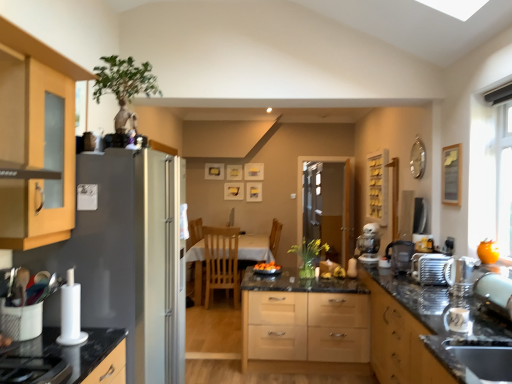
Question: Considering the relative positions of satin silver toaster at right and wooden cabinet at upper center, placed as the 1th cabinetry when sorted from back to front, in the image provided, is satin silver toaster at right to the left or to the right of wooden cabinet at upper center, placed as the 1th cabinetry when sorted from back to front,?

Choices:
 (A) left
 (B) right

Answer: (A)

Question: Considering the positions of satin silver toaster at right and wooden cabinet at upper center, placed as the 1th cabinetry when sorted from back to front, in the image, is satin silver toaster at right wider or thinner than wooden cabinet at upper center, placed as the 1th cabinetry when sorted from back to front,?

Choices:
 (A) wide
 (B) thin

Answer: (A)

Question: Which object is the farthest from the white glossy table at center?

Choices:
 (A) light wood chair at center
 (B) wooden picture frame at center, positioned as the 1th picture frame in back-to-front order
 (C) matte wood cabinet at left, which is the first cabinetry from left to right
 (D) wooden picture frame at upper right, the 3th picture frame viewed from the back
 (E) translucent glass vase at center

Answer: (C)

Question: Estimate the real-world distances between objects in this image. Which object is closer to the wooden picture frame at upper right, the 3th picture frame viewed from the back?

Choices:
 (A) clear glass screen door at center
 (B) translucent glass vase at center
 (C) satin silver toaster at right, positioned as the 1th appliance in right-to-left order
 (D) matte white picture frame at center, the second picture frame from the back
 (E) satin silver sink at lower right

Answer: (C)